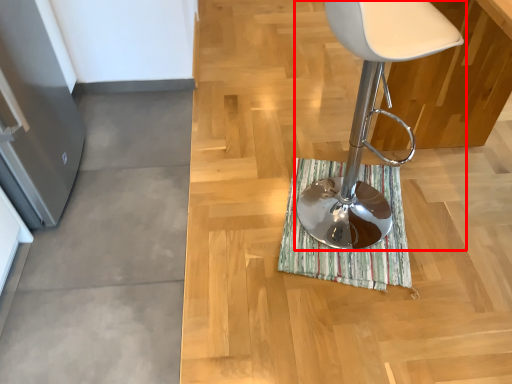
Question: From the image's perspective, where is chair (annotated by the red box) located relative to bath mat?

Choices:
 (A) above
 (B) below

Answer: (A)